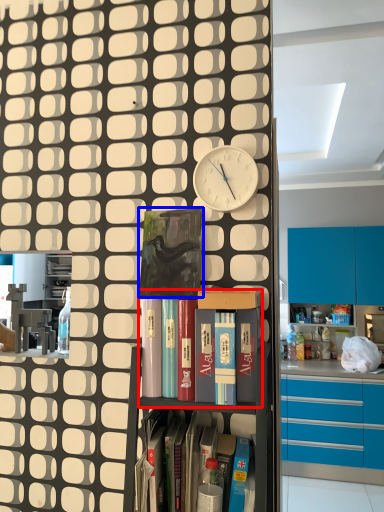
Question: Which of the following is the farthest to the observer, shelf (highlighted by a red box) or paperback book (highlighted by a blue box)?

Choices:
 (A) shelf
 (B) paperback book

Answer: (B)